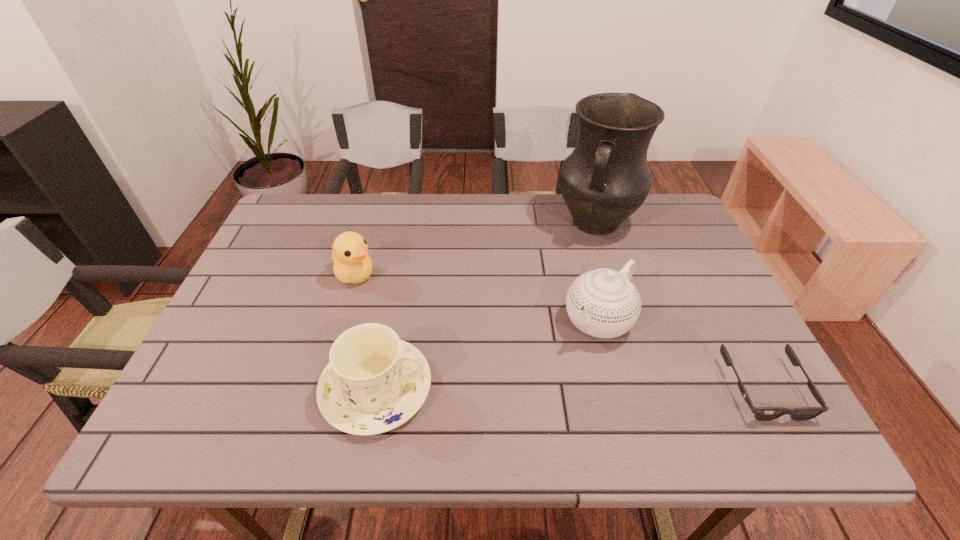
You are a GUI agent. You are given a task and a screenshot of the screen. Output one action in this format:
    pyautogui.click(x=<x>, y=<y>)
    Task: Click on the sunglasses that is at the right edge
    
    Given the screenshot: What is the action you would take?
    pyautogui.click(x=760, y=413)

You are a GUI agent. You are given a task and a screenshot of the screen. Output one action in this format:
    pyautogui.click(x=<x>, y=<y>)
    Task: Click on the pitcher that is at the right edge
    This screenshot has height=540, width=960.
    Given the screenshot: What is the action you would take?
    pyautogui.click(x=606, y=178)

You are a GUI agent. You are given a task and a screenshot of the screen. Output one action in this format:
    pyautogui.click(x=<x>, y=<y>)
    Task: Click on the object situated at the far right corner
    The height and width of the screenshot is (540, 960).
    Given the screenshot: What is the action you would take?
    pyautogui.click(x=606, y=178)

Locate an element on the screen. object that is at the near right corner is located at coordinates (760, 413).

Where is `vacant space at the far edge of the desktop`? This screenshot has height=540, width=960. vacant space at the far edge of the desktop is located at coordinates pyautogui.click(x=358, y=222).

Where is `vacant space at the near edge`? This screenshot has height=540, width=960. vacant space at the near edge is located at coordinates (617, 381).

Identify the location of vacant space at the left edge of the desktop. The width and height of the screenshot is (960, 540). (244, 349).

Locate an element on the screen. free space at the far left corner is located at coordinates (304, 232).

In the image, there is a desktop. Find the location of `blank space at the near left corner`. blank space at the near left corner is located at coordinates (268, 369).

Locate an element on the screen. This screenshot has height=540, width=960. free spot at the near right corner of the desktop is located at coordinates (724, 370).